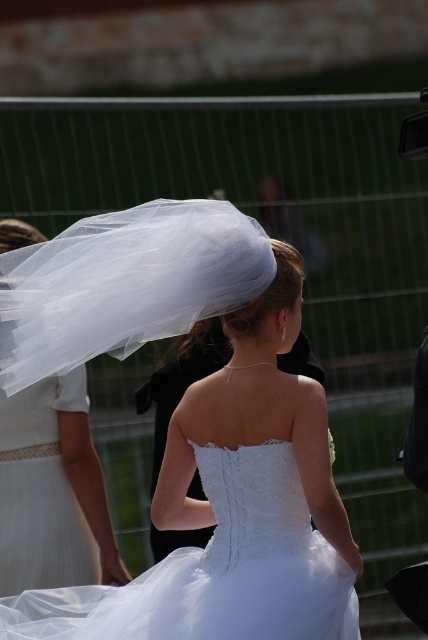
Question: Can you confirm if white tulle veil at upper center is wider than white tulle veil at upper left?

Choices:
 (A) yes
 (B) no

Answer: (A)

Question: Can you confirm if white tulle veil at upper center is positioned to the left of white tulle veil at upper left?

Choices:
 (A) no
 (B) yes

Answer: (A)

Question: Considering the relative positions of white tulle veil at upper center and white tulle veil at upper left in the image provided, where is white tulle veil at upper center located with respect to white tulle veil at upper left?

Choices:
 (A) above
 (B) below

Answer: (A)